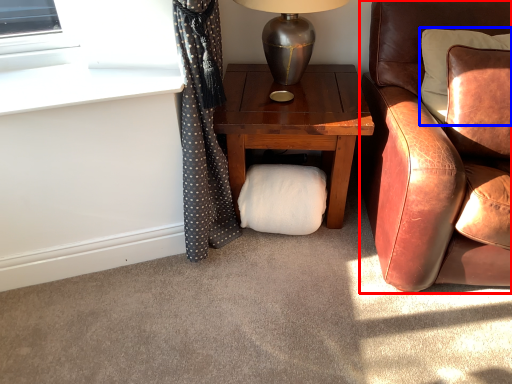
Question: Which object is closer to the camera taking this photo, chair (highlighted by a red box) or pillow (highlighted by a blue box)?

Choices:
 (A) chair
 (B) pillow

Answer: (A)